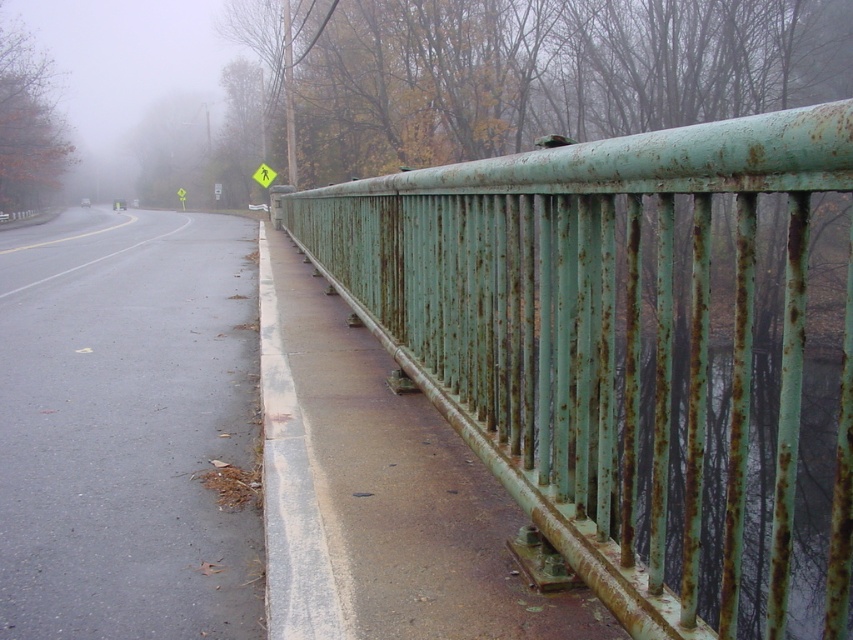
Question: Does rusty green metal fence at right have a lesser width compared to yellow paper pedestrian at upper center?

Choices:
 (A) no
 (B) yes

Answer: (A)

Question: Which of the following is the farthest from the observer?

Choices:
 (A) rusty green metal fence at right
 (B) yellow paper pedestrian at upper center

Answer: (B)

Question: Which of the following is the closest to the observer?

Choices:
 (A) (265, 180)
 (B) (550, 268)

Answer: (B)

Question: Is rusty green metal fence at right smaller than yellow paper pedestrian at upper center?

Choices:
 (A) yes
 (B) no

Answer: (B)

Question: Can you confirm if rusty green metal fence at right is positioned to the left of yellow paper pedestrian at upper center?

Choices:
 (A) yes
 (B) no

Answer: (B)